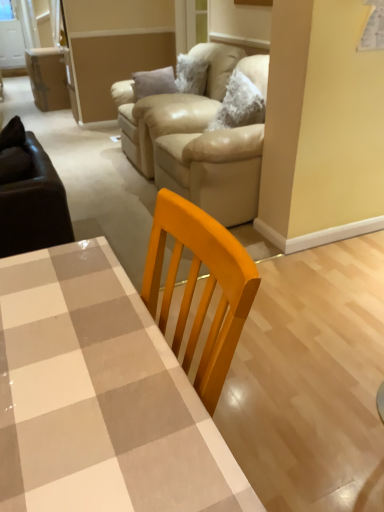
Question: From the image's perspective, is checkered glossy table at center beneath beige leather couch at upper center?

Choices:
 (A) yes
 (B) no

Answer: (A)

Question: From the image's perspective, does checkered glossy table at center appear higher than beige leather couch at upper center?

Choices:
 (A) no
 (B) yes

Answer: (A)

Question: Is checkered glossy table at center at the right side of beige leather couch at upper center?

Choices:
 (A) no
 (B) yes

Answer: (A)

Question: Is checkered glossy table at center taller than beige leather couch at upper center?

Choices:
 (A) yes
 (B) no

Answer: (B)

Question: Can you confirm if checkered glossy table at center is bigger than beige leather couch at upper center?

Choices:
 (A) yes
 (B) no

Answer: (B)

Question: Does checkered glossy table at center have a greater width compared to beige leather couch at upper center?

Choices:
 (A) no
 (B) yes

Answer: (A)

Question: Is beige leather armchair at upper center located outside checkered glossy table at center?

Choices:
 (A) yes
 (B) no

Answer: (A)

Question: Is beige leather armchair at upper center taller than checkered glossy table at center?

Choices:
 (A) yes
 (B) no

Answer: (B)

Question: Would you say checkered glossy table at center is part of beige leather armchair at upper center's contents?

Choices:
 (A) yes
 (B) no

Answer: (B)

Question: Is beige leather armchair at upper center with checkered glossy table at center?

Choices:
 (A) no
 (B) yes

Answer: (A)

Question: Is beige leather armchair at upper center aimed at checkered glossy table at center?

Choices:
 (A) no
 (B) yes

Answer: (A)

Question: Is beige leather armchair at upper center shorter than checkered glossy table at center?

Choices:
 (A) no
 (B) yes

Answer: (B)

Question: Would you say beige leather couch at upper center is outside checkered glossy table at center?

Choices:
 (A) no
 (B) yes

Answer: (B)